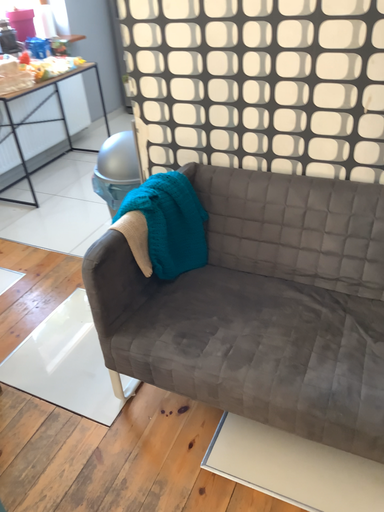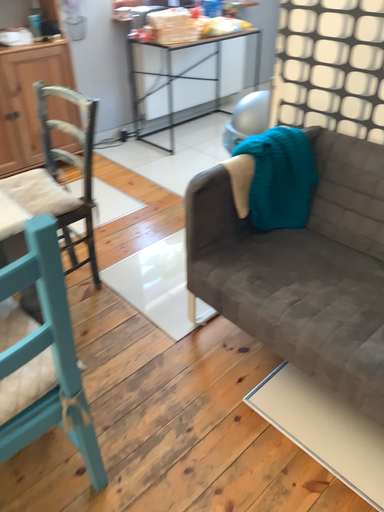
Question: Which way did the camera rotate in the video?

Choices:
 (A) rotated left
 (B) rotated right

Answer: (A)